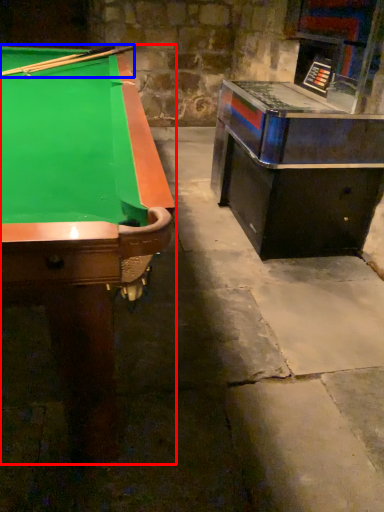
Question: Which object appears closest to the camera in this image, billiard table (highlighted by a red box) or cue (highlighted by a blue box)?

Choices:
 (A) billiard table
 (B) cue

Answer: (A)